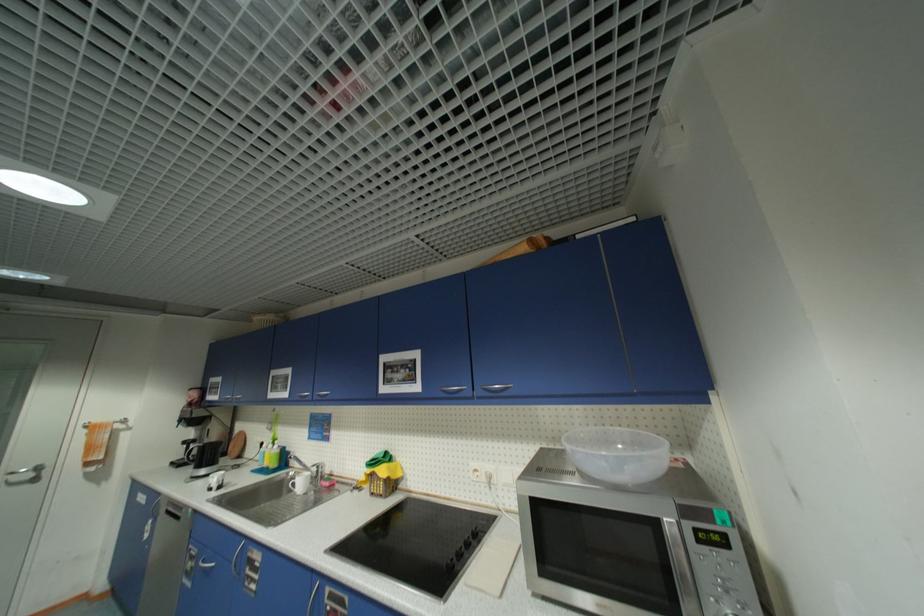
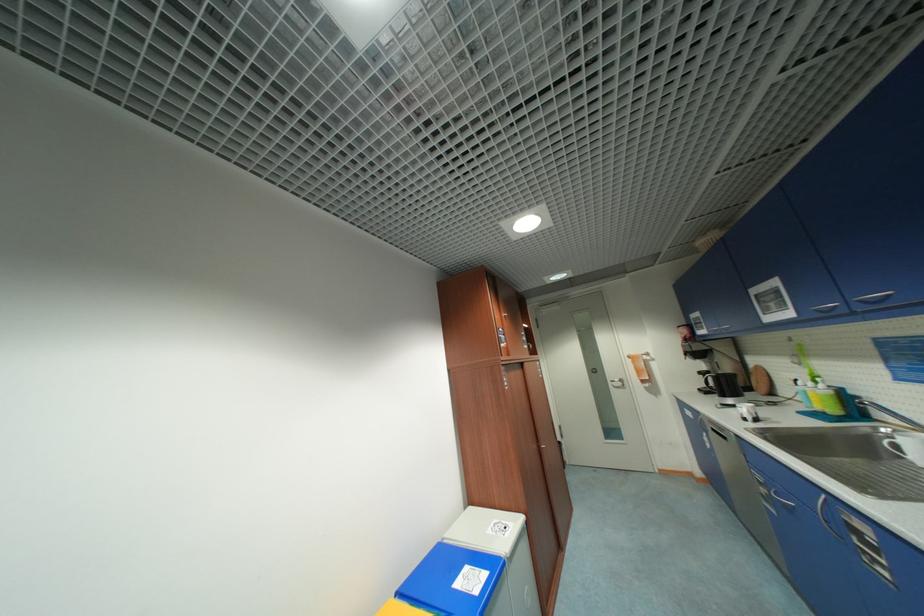
The point at (298, 493) is marked in the first image. Where is the corresponding point in the second image?

(906, 458)